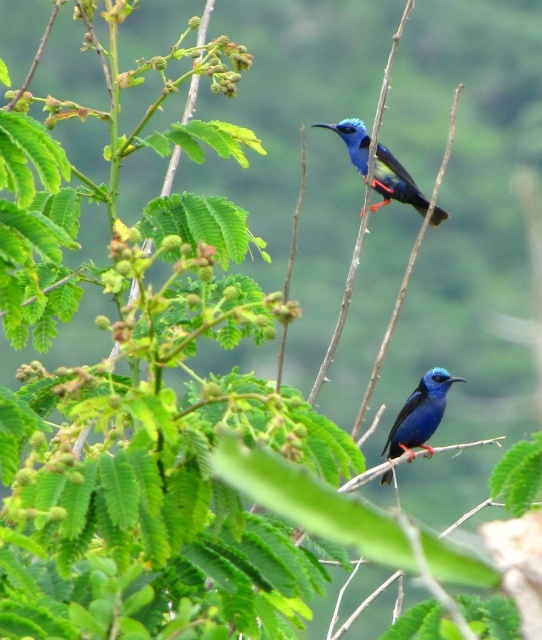
Question: Among these objects, which one is nearest to the camera?

Choices:
 (A) glossy blue bird at center
 (B) glossy blue hummingbird at upper center

Answer: (B)

Question: Is glossy blue hummingbird at upper center smaller than glossy blue bird at center?

Choices:
 (A) no
 (B) yes

Answer: (A)

Question: Can you confirm if glossy blue hummingbird at upper center is positioned below glossy blue bird at center?

Choices:
 (A) yes
 (B) no

Answer: (B)

Question: Which point is farther to the camera?

Choices:
 (A) (435, 381)
 (B) (373, 188)

Answer: (A)

Question: Can you confirm if glossy blue hummingbird at upper center is positioned to the right of glossy blue bird at center?

Choices:
 (A) yes
 (B) no

Answer: (B)

Question: Which point is farther from the camera taking this photo?

Choices:
 (A) (429, 385)
 (B) (376, 204)

Answer: (A)